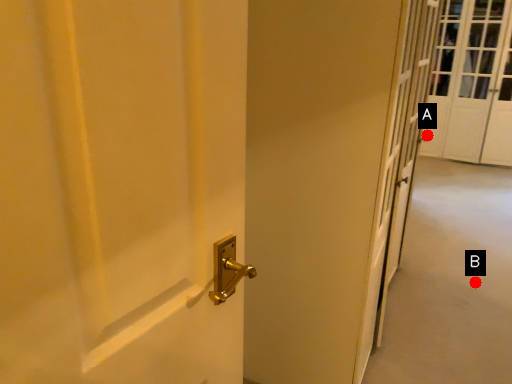
Question: Two points are circled on the image, labeled by A and B beside each circle. Which of the following is the closest to the observer?

Choices:
 (A) A is closer
 (B) B is closer

Answer: (B)